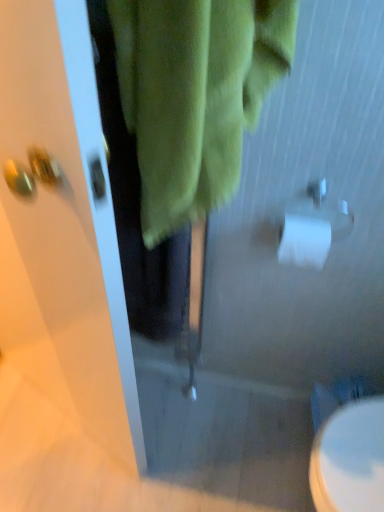
This screenshot has width=384, height=512. Describe the element at coordinates (312, 226) in the screenshot. I see `white matte toilet paper at right` at that location.

Locate an element on the screen. white matte toilet paper at right is located at coordinates (312, 226).

Measure the distance between point (352, 411) and camera.

Point (352, 411) and camera are 97.70 centimeters apart.

Image resolution: width=384 pixels, height=512 pixels. In order to click on white glossy toilet at lower right in this screenshot , I will do click(x=350, y=459).

This screenshot has width=384, height=512. What do you see at coordinates (350, 459) in the screenshot? I see `white glossy toilet at lower right` at bounding box center [350, 459].

What is the approximate height of white glossy toilet at lower right?

white glossy toilet at lower right is 23.93 centimeters in height.

In order to face white glossy toilet at lower right, should I rotate leftwards or rightwards?

Rotate right and turn 20.540 degrees.

You are a GUI agent. You are given a task and a screenshot of the screen. Output one action in this format:
    pyautogui.click(x=<x>, y=<y>)
    Task: Click on the white matte toilet paper at right
    The width and height of the screenshot is (384, 512).
    Given the screenshot: What is the action you would take?
    pyautogui.click(x=312, y=226)

Does white matte toilet paper at right appear on the left side of white glossy toilet at lower right?

Yes, white matte toilet paper at right is to the left of white glossy toilet at lower right.

Does white matte toilet paper at right come behind white glossy toilet at lower right?

No, white matte toilet paper at right is in front of white glossy toilet at lower right.

Considering the positions of points (320, 181) and (367, 424), is point (320, 181) farther from camera compared to point (367, 424)?

That is False.

From the image's perspective, which is above, white matte toilet paper at right or white glossy toilet at lower right?

white matte toilet paper at right is shown above in the image.

From a real-world perspective, is white matte toilet paper at right positioned under white glossy toilet at lower right based on gravity?

Actually, white matte toilet paper at right is physically above white glossy toilet at lower right in the real world.

Between white matte toilet paper at right and white glossy toilet at lower right, which one has smaller width?

white matte toilet paper at right.

From the picture: Does white matte toilet paper at right have a greater height compared to white glossy toilet at lower right?

No, white matte toilet paper at right is not taller than white glossy toilet at lower right.

Considering the relative sizes of white matte toilet paper at right and white glossy toilet at lower right in the image provided, is white matte toilet paper at right smaller than white glossy toilet at lower right?

Yes, white matte toilet paper at right is smaller than white glossy toilet at lower right.

Is white matte toilet paper at right positioned beyond the bounds of white glossy toilet at lower right?

Indeed, white matte toilet paper at right is completely outside white glossy toilet at lower right.

Is white matte toilet paper at right not near white glossy toilet at lower right?

white matte toilet paper at right is near white glossy toilet at lower right, not far away.

Is white matte toilet paper at right oriented away from white glossy toilet at lower right?

white matte toilet paper at right does not have its back to white glossy toilet at lower right.

Can you tell me how much white matte toilet paper at right and white glossy toilet at lower right differ in facing direction?

The angle between the facing direction of white matte toilet paper at right and the facing direction of white glossy toilet at lower right is 89.4 degrees.

Where is `toilet paper above the white glossy toilet at lower right (from a real-world perspective)`? toilet paper above the white glossy toilet at lower right (from a real-world perspective) is located at coordinates (312, 226).

Which is more to the right, white glossy toilet at lower right or white matte toilet paper at right?

white glossy toilet at lower right is more to the right.

Considering the positions of objects white glossy toilet at lower right and white matte toilet paper at right in the image provided, who is in front, white glossy toilet at lower right or white matte toilet paper at right?

white matte toilet paper at right is in front.

Which is closer to the camera, [347,453] or [328,230]?

Clearly, point [347,453] is closer to the camera than point [328,230].

From the image's perspective, relative to white matte toilet paper at right, is white glossy toilet at lower right above or below?

From the image's perspective, white glossy toilet at lower right appears below white matte toilet paper at right.

Looking at this image, from a real-world perspective, which object rests below the other?

white glossy toilet at lower right, from a real-world perspective.

Can you confirm if white glossy toilet at lower right is thinner than white matte toilet paper at right?

Incorrect, the width of white glossy toilet at lower right is not less than that of white matte toilet paper at right.

Who is taller, white glossy toilet at lower right or white matte toilet paper at right?

white glossy toilet at lower right.

Considering the sizes of objects white glossy toilet at lower right and white matte toilet paper at right in the image provided, who is bigger, white glossy toilet at lower right or white matte toilet paper at right?

Bigger between the two is white glossy toilet at lower right.

Can we say white glossy toilet at lower right lies outside white matte toilet paper at right?

Indeed, white glossy toilet at lower right is completely outside white matte toilet paper at right.

Is white glossy toilet at lower right with white matte toilet paper at right?

No.

Is white glossy toilet at lower right positioned with its back to white matte toilet paper at right?

No, white glossy toilet at lower right's orientation is not away from white matte toilet paper at right.

How distant is white glossy toilet at lower right from white matte toilet paper at right?

white glossy toilet at lower right is 17.08 inches away from white matte toilet paper at right.

Locate an element on the screen. The image size is (384, 512). toilet below the white matte toilet paper at right (from the image's perspective) is located at coordinates (350, 459).

The width and height of the screenshot is (384, 512). Identify the location of toilet below the white matte toilet paper at right (from the image's perspective). (350, 459).

Image resolution: width=384 pixels, height=512 pixels. Find the location of `toilet paper above the white glossy toilet at lower right (from a real-world perspective)`. toilet paper above the white glossy toilet at lower right (from a real-world perspective) is located at coordinates (312, 226).